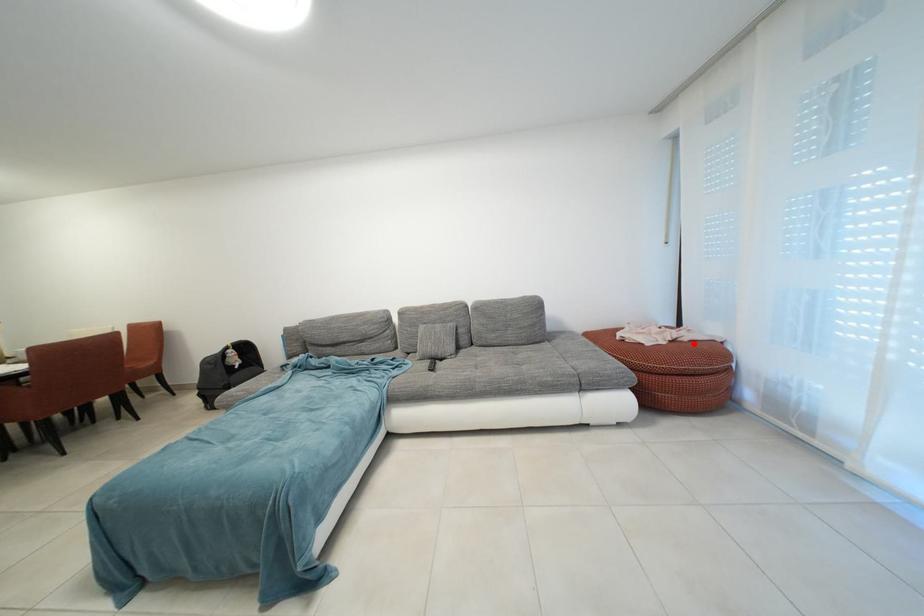
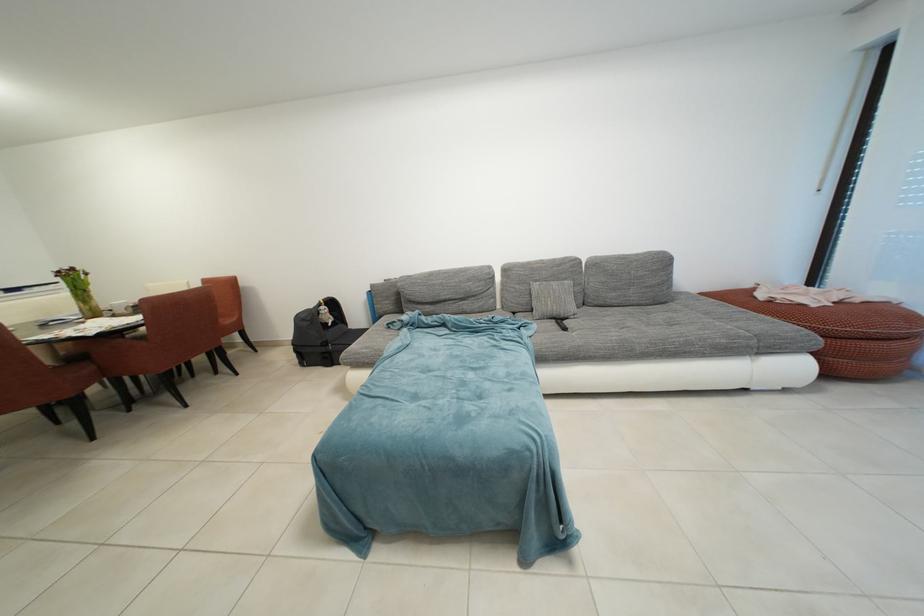
Where in the second image is the point corresponding to the highlighted location from the first image?

(865, 305)